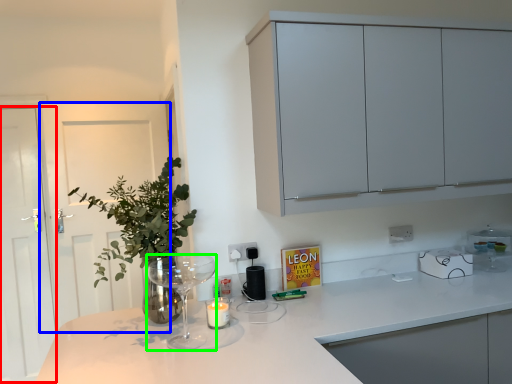
Question: Which is nearer to the glass door (highlighted by a red box)? door (highlighted by a blue box) or wine glass (highlighted by a green box).

Choices:
 (A) door
 (B) wine glass

Answer: (A)